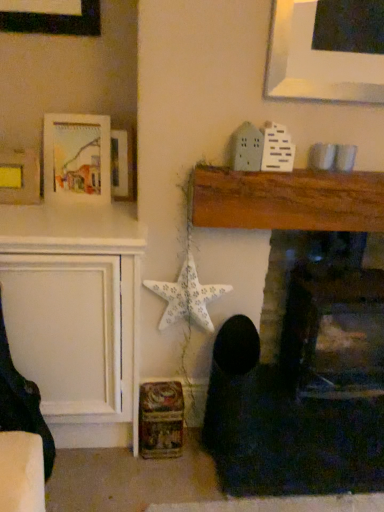
The height and width of the screenshot is (512, 384). Describe the element at coordinates (19, 176) in the screenshot. I see `matte yellow paper at upper left, marked as the 1th picture frame in a left-to-right arrangement` at that location.

Where is `wooden fireplace at center, the 2th fireplace in the right-to-left sequence`? wooden fireplace at center, the 2th fireplace in the right-to-left sequence is located at coordinates (302, 340).

Are dark fabric rocking chair at left and smooth stone fireplace at center, which appears as the 1th fireplace when viewed from the right, making contact?

No, dark fabric rocking chair at left is not touching smooth stone fireplace at center, which appears as the 1th fireplace when viewed from the right.

Who is bigger, dark fabric rocking chair at left or smooth stone fireplace at center, which is the second fireplace in left-to-right order?

smooth stone fireplace at center, which is the second fireplace in left-to-right order.

Looking at this image, considering the relative positions of dark fabric rocking chair at left and smooth stone fireplace at center, which is the second fireplace in left-to-right order, in the image provided, is dark fabric rocking chair at left to the left of smooth stone fireplace at center, which is the second fireplace in left-to-right order, from the viewer's perspective?

Correct, you'll find dark fabric rocking chair at left to the left of smooth stone fireplace at center, which is the second fireplace in left-to-right order.

From the picture: From a real-world perspective, is dark fabric rocking chair at left over smooth stone fireplace at center, which is the second fireplace in left-to-right order?

Actually, dark fabric rocking chair at left is physically below smooth stone fireplace at center, which is the second fireplace in left-to-right order, in the real world.

From the image's perspective, is white paper star at center-left beneath smooth stone fireplace at center, which is the second fireplace in left-to-right order?

No.

Image resolution: width=384 pixels, height=512 pixels. I want to click on fireplace located behind the white paper star at center-left, so click(326, 313).

Is point (156, 283) in front of point (279, 239)?

Yes, point (156, 283) is closer to viewer.

In the scene shown: From a real-world perspective, is white paper star at center-left physically above smooth stone fireplace at center, which is the second fireplace in left-to-right order?

Yes.

Identify the location of picture frame that is the 1st object located above the white paper star at center-left (from the image's perspective). Image resolution: width=384 pixels, height=512 pixels. (19, 176).

Can you confirm if matte yellow paper at upper left, which ranks as the third picture frame in right-to-left order, is smaller than white paper star at center-left?

Yes, matte yellow paper at upper left, which ranks as the third picture frame in right-to-left order, is smaller than white paper star at center-left.

From a real-world perspective, which is physically above, matte yellow paper at upper left, marked as the 1th picture frame in a left-to-right arrangement, or white paper star at center-left?

matte yellow paper at upper left, marked as the 1th picture frame in a left-to-right arrangement, from a real-world perspective.

Consider the image. Who is more distant, matte yellow paper at upper left, marked as the 1th picture frame in a left-to-right arrangement, or white paper star at center-left?

Positioned behind is matte yellow paper at upper left, marked as the 1th picture frame in a left-to-right arrangement.

Does white paper star at center-left appear on the right side of wooden fireplace at center, the 2th fireplace in the right-to-left sequence?

No, white paper star at center-left is not to the right of wooden fireplace at center, the 2th fireplace in the right-to-left sequence.

Which is behind, point (208, 320) or point (264, 207)?

The point (208, 320) is more distant.

Can you confirm if white paper star at center-left is shorter than wooden fireplace at center, the 1th fireplace positioned from the left?

Yes, white paper star at center-left is shorter than wooden fireplace at center, the 1th fireplace positioned from the left.

Is white paper star at center-left in front of wooden fireplace at center, the 1th fireplace positioned from the left?

No, white paper star at center-left is behind wooden fireplace at center, the 1th fireplace positioned from the left.

From a real-world perspective, is white paper star at center-left on top of matte yellow paper at upper left, marked as the 1th picture frame in a left-to-right arrangement?

Incorrect, from a real-world perspective, white paper star at center-left is lower than matte yellow paper at upper left, marked as the 1th picture frame in a left-to-right arrangement.

Would you consider white paper star at center-left to be distant from matte yellow paper at upper left, marked as the 1th picture frame in a left-to-right arrangement?

white paper star at center-left is near matte yellow paper at upper left, marked as the 1th picture frame in a left-to-right arrangement, not far away.

Considering the positions of objects white paper star at center-left and matte yellow paper at upper left, which ranks as the third picture frame in right-to-left order, in the image provided, who is more to the right, white paper star at center-left or matte yellow paper at upper left, which ranks as the third picture frame in right-to-left order,?

white paper star at center-left is more to the right.

Find the location of a particular element. The image size is (384, 512). starfish located on the right of matte yellow paper at upper left, which ranks as the third picture frame in right-to-left order is located at coordinates (187, 296).

Does point (33, 406) come closer to viewer compared to point (27, 192)?

Yes, point (33, 406) is closer to viewer.

Considering the relative sizes of dark fabric rocking chair at left and matte yellow paper at upper left, marked as the 1th picture frame in a left-to-right arrangement, in the image provided, is dark fabric rocking chair at left taller than matte yellow paper at upper left, marked as the 1th picture frame in a left-to-right arrangement,?

Indeed, dark fabric rocking chair at left has a greater height compared to matte yellow paper at upper left, marked as the 1th picture frame in a left-to-right arrangement.

Considering the relative positions of dark fabric rocking chair at left and matte yellow paper at upper left, which ranks as the third picture frame in right-to-left order, in the image provided, is dark fabric rocking chair at left to the right of matte yellow paper at upper left, which ranks as the third picture frame in right-to-left order, from the viewer's perspective?

Yes.

Where is `picture frame that is the 1st one when counting upward from the dark fabric rocking chair at left (from the image's perspective)`? This screenshot has width=384, height=512. picture frame that is the 1st one when counting upward from the dark fabric rocking chair at left (from the image's perspective) is located at coordinates (19, 176).

Is matte yellow paper at upper left, which ranks as the third picture frame in right-to-left order, inside or outside of wooden picture frame at upper left, which is the third picture frame in left-to-right order?

matte yellow paper at upper left, which ranks as the third picture frame in right-to-left order, lies outside wooden picture frame at upper left, which is the third picture frame in left-to-right order.

Which is in front, point (18, 165) or point (122, 166)?

The point (18, 165) is in front.

Is matte yellow paper at upper left, which ranks as the third picture frame in right-to-left order, facing towards wooden picture frame at upper left, which is the third picture frame in left-to-right order?

No, matte yellow paper at upper left, which ranks as the third picture frame in right-to-left order, is not oriented towards wooden picture frame at upper left, which is the third picture frame in left-to-right order.

From the image's perspective, which picture frame is the 1st one above the matte yellow paper at upper left, marked as the 1th picture frame in a left-to-right arrangement? Please provide its 2D coordinates.

[(123, 163)]

This screenshot has width=384, height=512. I want to click on the 1st fireplace directly above the dark fabric rocking chair at left (from a real-world perspective), so click(x=326, y=313).

I want to click on the 2nd fireplace below the white paper star at center-left (from the image's perspective), so click(326, 313).

When comparing their distances from wooden picture frame at upper left, which is the third picture frame in left-to-right order, does smooth stone fireplace at center, which appears as the 1th fireplace when viewed from the right, or matte white picture frame at upper left, positioned as the second picture frame in right-to-left order, seem closer?

matte white picture frame at upper left, positioned as the second picture frame in right-to-left order, is closer to wooden picture frame at upper left, which is the third picture frame in left-to-right order.

Looking at the image, which one is located further to wooden fireplace at center, the 2th fireplace in the right-to-left sequence, matte yellow paper at upper left, marked as the 1th picture frame in a left-to-right arrangement, or white paper star at center-left?

matte yellow paper at upper left, marked as the 1th picture frame in a left-to-right arrangement.

Considering their positions, is dark fabric rocking chair at left positioned further to matte yellow paper at upper left, marked as the 1th picture frame in a left-to-right arrangement, than wooden picture frame at upper left, the 1th picture frame from the right?

Based on the image, dark fabric rocking chair at left appears to be further to matte yellow paper at upper left, marked as the 1th picture frame in a left-to-right arrangement.

Looking at this image, which object lies nearer to the anchor point matte yellow paper at upper left, which ranks as the third picture frame in right-to-left order, dark fabric rocking chair at left or wooden fireplace at center, the 2th fireplace in the right-to-left sequence?

dark fabric rocking chair at left lies closer to matte yellow paper at upper left, which ranks as the third picture frame in right-to-left order, than the other object.

Which object lies nearer to the anchor point white paper star at center-left, matte yellow paper at upper left, which ranks as the third picture frame in right-to-left order, or wooden picture frame at upper left, the 1th picture frame from the right?

wooden picture frame at upper left, the 1th picture frame from the right, is closer to white paper star at center-left.

Considering their positions, is white paper star at center-left positioned closer to wooden fireplace at center, the 1th fireplace positioned from the left, than dark fabric rocking chair at left?

white paper star at center-left is closer to wooden fireplace at center, the 1th fireplace positioned from the left.

Looking at the image, which one is located closer to dark fabric rocking chair at left, wooden fireplace at center, the 1th fireplace positioned from the left, or matte white picture frame at upper left, marked as the 2th picture frame in a left-to-right arrangement?

matte white picture frame at upper left, marked as the 2th picture frame in a left-to-right arrangement, is closer to dark fabric rocking chair at left.

Estimate the real-world distances between objects in this image. Which object is further from matte white picture frame at upper left, positioned as the second picture frame in right-to-left order, dark fabric rocking chair at left or matte yellow paper at upper left, marked as the 1th picture frame in a left-to-right arrangement?

Among the two, dark fabric rocking chair at left is located further to matte white picture frame at upper left, positioned as the second picture frame in right-to-left order.

Image resolution: width=384 pixels, height=512 pixels. In order to click on rocking chair situated between matte yellow paper at upper left, which ranks as the third picture frame in right-to-left order, and smooth stone fireplace at center, which appears as the 1th fireplace when viewed from the right, from left to right in this screenshot , I will do `click(21, 402)`.

The height and width of the screenshot is (512, 384). Find the location of `starfish between matte yellow paper at upper left, marked as the 1th picture frame in a left-to-right arrangement, and smooth stone fireplace at center, which is the second fireplace in left-to-right order`. starfish between matte yellow paper at upper left, marked as the 1th picture frame in a left-to-right arrangement, and smooth stone fireplace at center, which is the second fireplace in left-to-right order is located at coordinates (187, 296).

Find the location of a particular element. The width and height of the screenshot is (384, 512). fireplace between white paper star at center-left and smooth stone fireplace at center, which is the second fireplace in left-to-right order, from left to right is located at coordinates (302, 340).

Identify the location of fireplace between matte white picture frame at upper left, marked as the 2th picture frame in a left-to-right arrangement, and smooth stone fireplace at center, which appears as the 1th fireplace when viewed from the right. This screenshot has height=512, width=384. (302, 340).